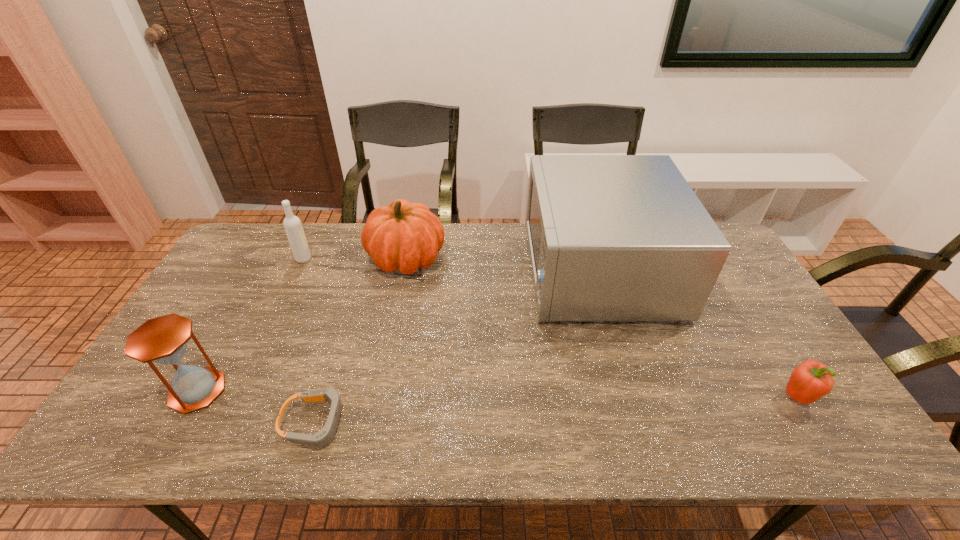
Locate an element on the screen. object present at the left edge is located at coordinates (163, 340).

The image size is (960, 540). Identify the location of object that is at the right edge. (811, 380).

Where is `free space at the far edge of the desktop`? free space at the far edge of the desktop is located at coordinates (464, 254).

In the image, there is a desktop. At what (x,y) coordinates should I click in order to perform the action: click on vacant space at the near edge. Please return your answer as a coordinate pair (x, y). The height and width of the screenshot is (540, 960). Looking at the image, I should click on (479, 450).

Where is `free location at the left edge of the desktop`? This screenshot has width=960, height=540. free location at the left edge of the desktop is located at coordinates (162, 384).

Identify the location of vacant area at the right edge of the desktop. The height and width of the screenshot is (540, 960). (774, 364).

You are a GUI agent. You are given a task and a screenshot of the screen. Output one action in this format:
    pyautogui.click(x=<x>, y=<y>)
    Task: Click on the free space at the far left corner of the desktop
    The width and height of the screenshot is (960, 540).
    Given the screenshot: What is the action you would take?
    pyautogui.click(x=275, y=253)

Find the location of a particular element. This screenshot has height=540, width=960. vacant area that lies between the vodka and the pumpkin is located at coordinates point(355,258).

I want to click on free space between the pepper and the hourglass, so click(497, 394).

The height and width of the screenshot is (540, 960). Find the location of `vacant area that lies between the pumpkin and the leftmost object`. vacant area that lies between the pumpkin and the leftmost object is located at coordinates (302, 324).